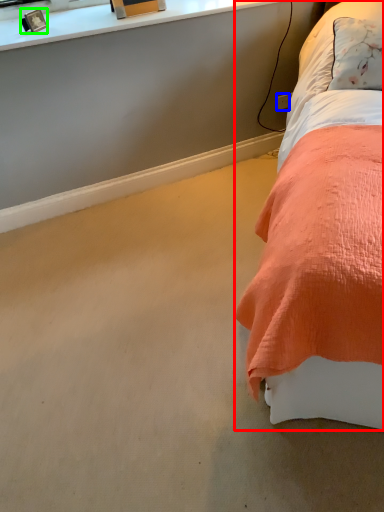
Question: Which object is positioned farthest from bed (highlighted by a red box)? Select from power outlet (highlighted by a blue box) and picture frame (highlighted by a green box).

Choices:
 (A) power outlet
 (B) picture frame

Answer: (B)